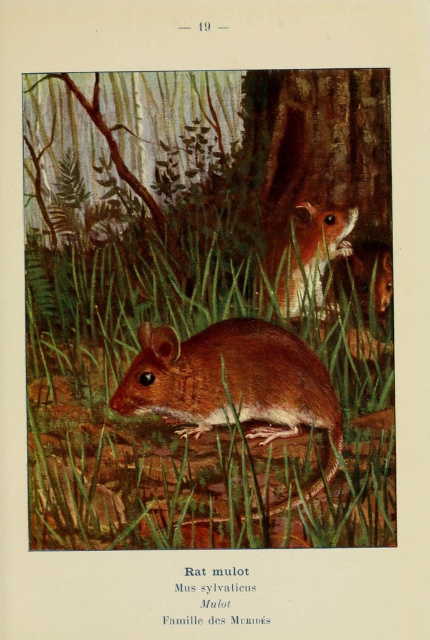
Which is more to the right, brown furry mouse at center or brown furry mouse at upper right?

brown furry mouse at upper right is more to the right.

Can you confirm if brown furry mouse at center is shorter than brown furry mouse at upper right?

No, brown furry mouse at center is not shorter than brown furry mouse at upper right.

Find the location of a particular element. The image size is (430, 640). brown furry mouse at center is located at coordinates (230, 380).

Which is more to the left, green grass at center or brown furry mouse at upper right?

From the viewer's perspective, green grass at center appears more on the left side.

What do you see at coordinates (209, 385) in the screenshot? This screenshot has height=640, width=430. I see `green grass at center` at bounding box center [209, 385].

Who is more distant from viewer, (316, 340) or (318, 257)?

Point (318, 257)

This screenshot has height=640, width=430. In order to click on green grass at center in this screenshot , I will do `click(209, 385)`.

Who is more forward, (36, 358) or (242, 394)?

Point (242, 394) is in front.

Can you confirm if green grass at center is taller than brown furry mouse at center?

Yes, green grass at center is taller than brown furry mouse at center.

Between point (151, 228) and point (175, 378), which one is positioned in front?

Point (175, 378)

This screenshot has height=640, width=430. I want to click on green grass at center, so click(x=209, y=385).